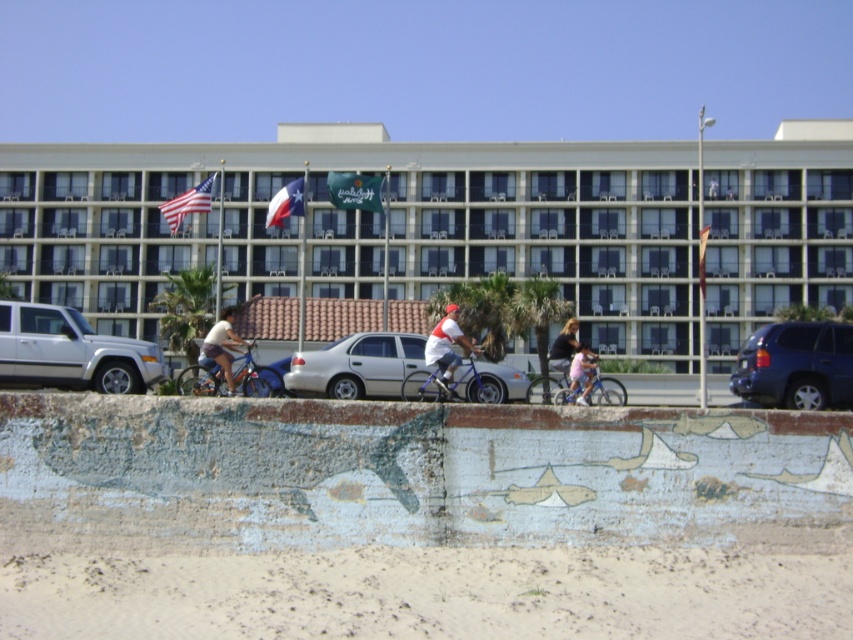
Is point (38, 257) positioned after point (556, 394)?

Yes, point (38, 257) is farther from viewer.

Where is `white glass building at center`? The width and height of the screenshot is (853, 640). white glass building at center is located at coordinates (451, 227).

Which is behind, point (231, 342) or point (700, 244)?

Positioned behind is point (700, 244).

Does point (219, 358) lie behind point (700, 237)?

That is False.

In order to click on matte blue shorts at center in this screenshot , I will do `click(221, 346)`.

Does silver metallic car at center appear on the left side of green fabric flag at center?

Incorrect, silver metallic car at center is not on the left side of green fabric flag at center.

Does silver metallic car at center have a greater width compared to green fabric flag at center?

Incorrect, silver metallic car at center's width does not surpass green fabric flag at center's.

Who is more forward, (x=486, y=396) or (x=375, y=204)?

Point (x=486, y=396)

Image resolution: width=853 pixels, height=640 pixels. I want to click on silver metallic car at center, so click(357, 365).